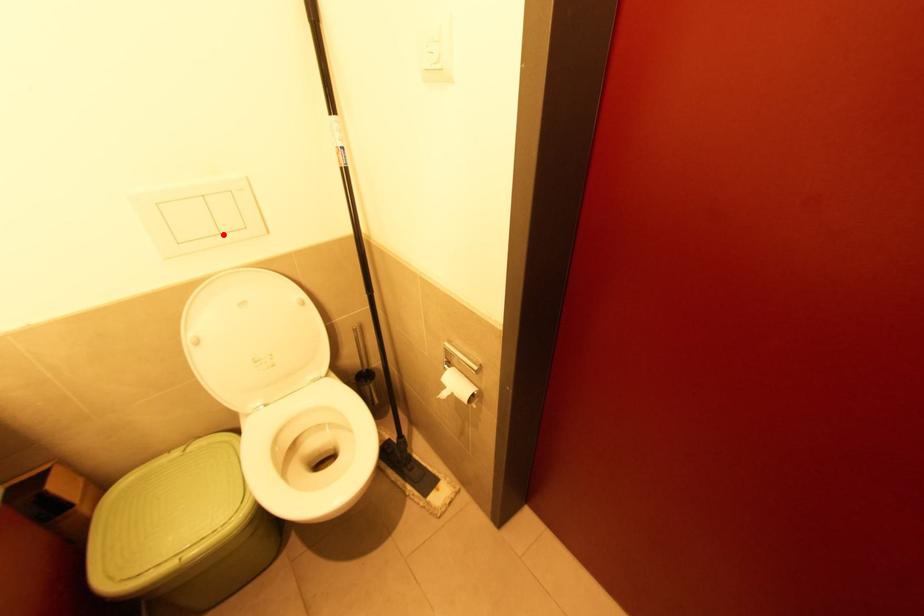
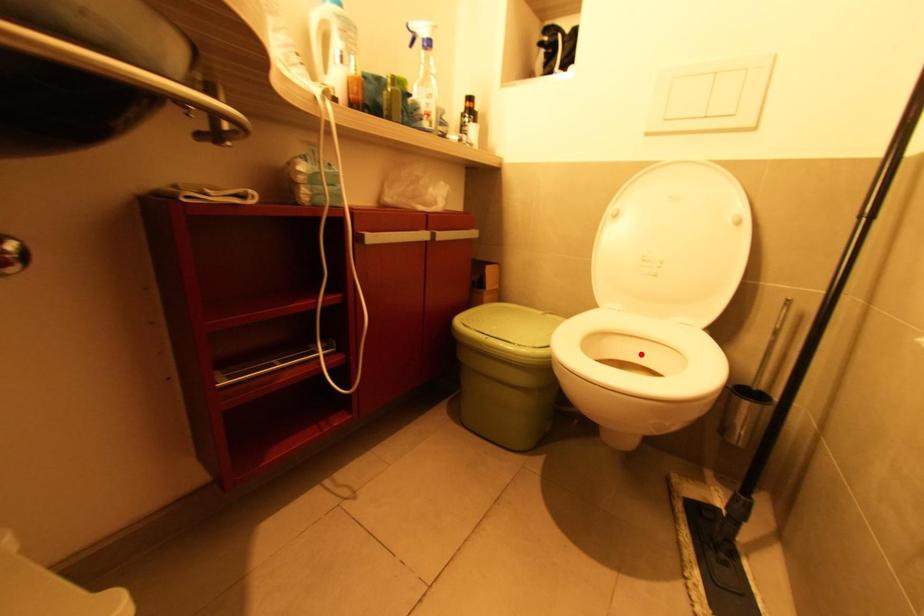
I am providing you with two images of the same scene from different viewpoints. A red point is marked on the first image and another point is marked on the second image. Are the points marked in image1 and image2 representing the same 3D position?

No